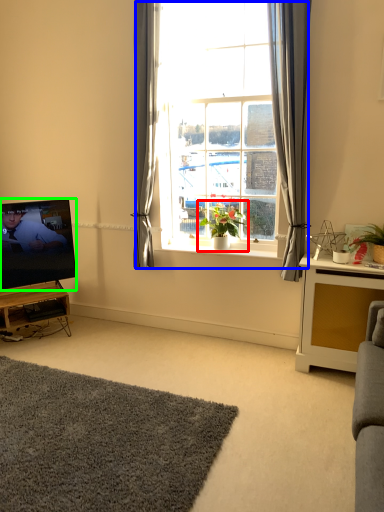
Question: Estimate the real-world distances between objects in this image. Which object is farther from houseplant (highlighted by a red box), window (highlighted by a blue box) or television (highlighted by a green box)?

Choices:
 (A) window
 (B) television

Answer: (B)